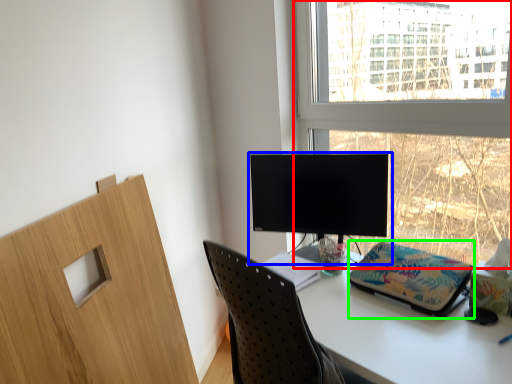
Question: Considering the real-world distances, which object is closest to window (highlighted by a red box)? computer monitor (highlighted by a blue box) or stationery (highlighted by a green box).

Choices:
 (A) computer monitor
 (B) stationery

Answer: (A)